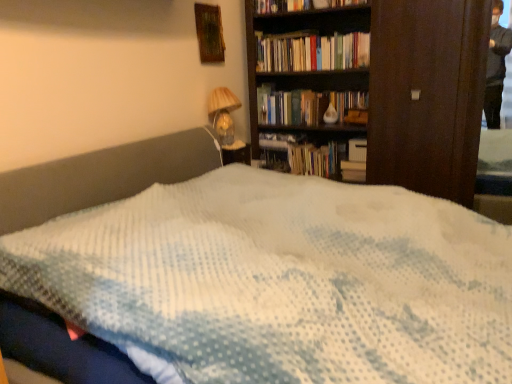
Question: Considering the positions of white matte paperback book at center-right and matte glass table lamp at upper center in the image, is white matte paperback book at center-right wider or thinner than matte glass table lamp at upper center?

Choices:
 (A) thin
 (B) wide

Answer: (A)

Question: From a real-world perspective, is white matte paperback book at center-right physically located above or below matte glass table lamp at upper center?

Choices:
 (A) below
 (B) above

Answer: (A)

Question: Estimate the real-world distances between objects in this image. Which object is farther from the white matte paperback book at center-right?

Choices:
 (A) matte glass table lamp at upper center
 (B) wooden frame at upper center
 (C) hardcover books at upper center

Answer: (B)

Question: Which of these objects is positioned closest to the hardcover books at upper center?

Choices:
 (A) matte glass table lamp at upper center
 (B) wooden frame at upper center
 (C) white matte paperback book at center-right

Answer: (B)